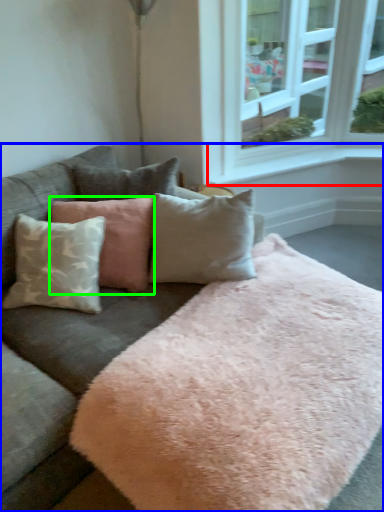
Question: Which object is the closest to the window sill (highlighted by a red box)? Choose among these: studio couch (highlighted by a blue box) or pillow (highlighted by a green box).

Choices:
 (A) studio couch
 (B) pillow

Answer: (B)